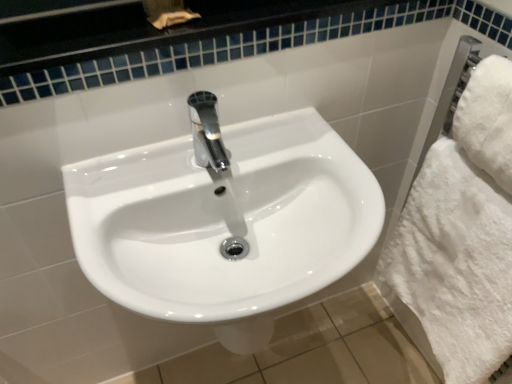
Question: Is point (169, 152) closer or farther from the camera than point (415, 246)?

Choices:
 (A) farther
 (B) closer

Answer: (B)

Question: Do you think white glossy sink at center is within white fluffy bath towel at right, the 2th bath towel when ordered from top to bottom, or outside of it?

Choices:
 (A) inside
 (B) outside

Answer: (B)

Question: Which is nearer to the white glossy sink at center?

Choices:
 (A) white fluffy bath towel at right, which is the first bath towel from bottom to top
 (B) white fluffy towel at right, which appears as the first bath towel when viewed from the top

Answer: (A)

Question: Considering the real-world distances, which object is closest to the white fluffy towel at right, which appears as the first bath towel when viewed from the top?

Choices:
 (A) white fluffy bath towel at right, the 2th bath towel when ordered from top to bottom
 (B) white glossy sink at center

Answer: (A)